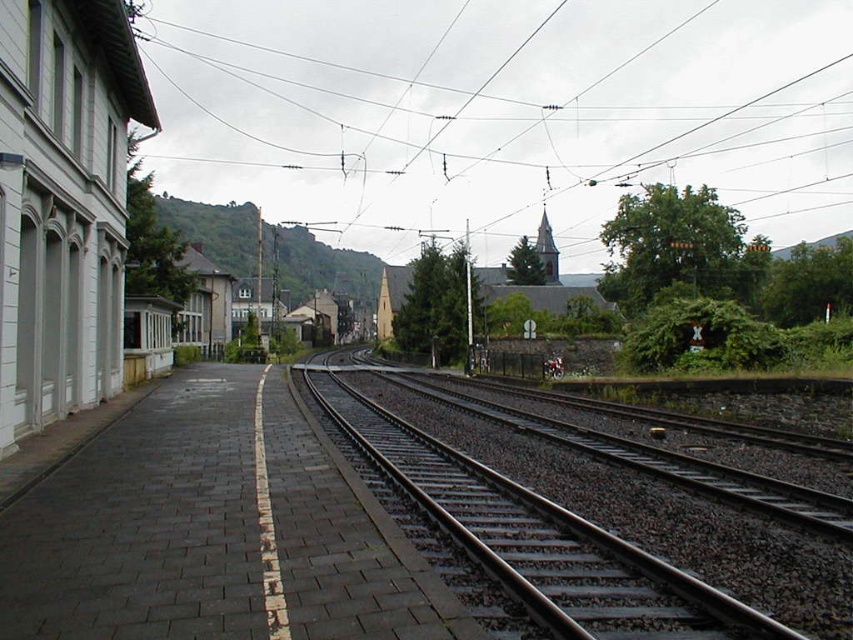
You are a maintenance worker checking the railway infrastructure. You notice the metallic wires at upper center and the black metal track at center. Which object requires more space for maintenance work due to its size?

The metallic wires at upper center requires more space for maintenance work because it has a larger size compared to the black metal track at center.

You are a train engineer approaching the station and need to determine the position of the black metal track at center relative to the metallic wires at upper center. Which one is closer to you?

The black metal track at center is behind the metallic wires at upper center, so the metallic wires at upper center are closer to you.

You are a maintenance worker needing to inspect the metallic wires at upper center. The safety regulations state that the distance between them must be at least 250 meters. Based on the scene, are the wires compliant with the safety standards?

The metallic wires at upper center are 265.05 meters apart, which exceeds the minimum requirement of 250 meters, so they comply with the safety standards.